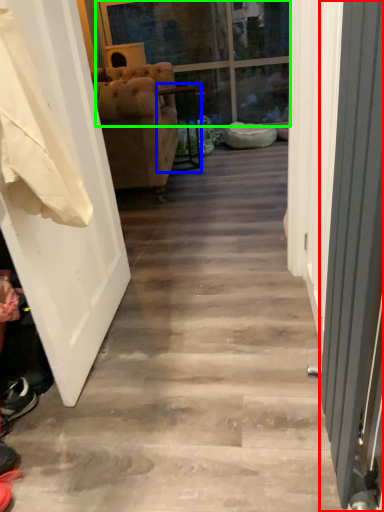
Question: Considering the real-world distances, which object is farthest from screen door (highlighted by a red box)? furniture (highlighted by a blue box) or glass door (highlighted by a green box)?

Choices:
 (A) furniture
 (B) glass door

Answer: (B)